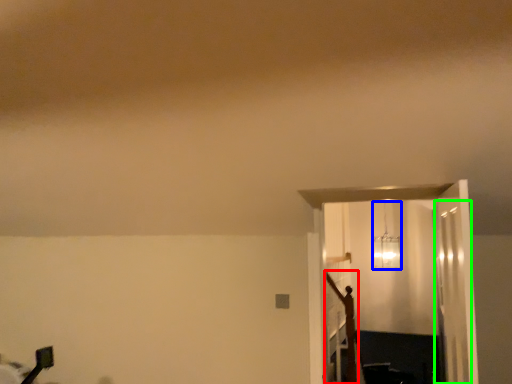
Question: Which is farther away from crucifix (highlighted by a red box)? lamp (highlighted by a blue box) or glass door (highlighted by a green box)?

Choices:
 (A) lamp
 (B) glass door

Answer: (A)